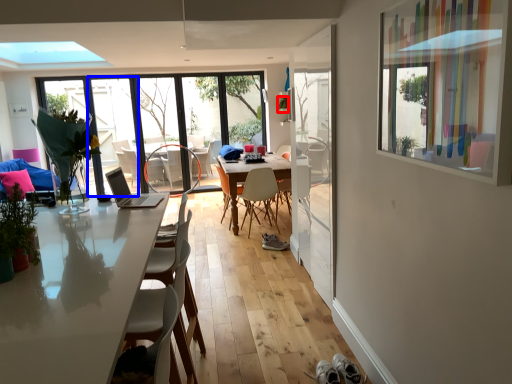
Question: Among these objects, which one is nearest to the camera, plant (highlighted by a red box) or door (highlighted by a blue box)?

Choices:
 (A) plant
 (B) door

Answer: (B)